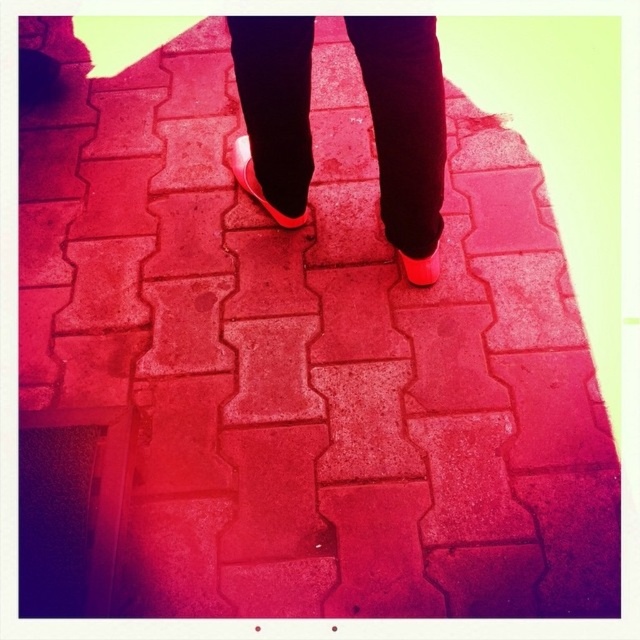
Question: Does matte pink shoes at center have a smaller size compared to shiny patent leather shoe at center?

Choices:
 (A) yes
 (B) no

Answer: (B)

Question: Does shiny patent leather shoe at center have a larger size compared to matte rubber shoe at center?

Choices:
 (A) yes
 (B) no

Answer: (A)

Question: Is matte pink shoes at center behind shiny patent leather shoe at center?

Choices:
 (A) no
 (B) yes

Answer: (A)

Question: Which of the following is the farthest from the observer?

Choices:
 (A) (234, 177)
 (B) (426, 275)
 (C) (241, 176)

Answer: (A)

Question: Estimate the real-world distances between objects in this image. Which object is farther from the matte pink shoes at center?

Choices:
 (A) shiny patent leather shoe at center
 (B) matte rubber shoe at center

Answer: (B)

Question: Estimate the real-world distances between objects in this image. Which object is closer to the matte rubber shoe at center?

Choices:
 (A) shiny patent leather shoe at center
 (B) matte pink shoes at center

Answer: (B)